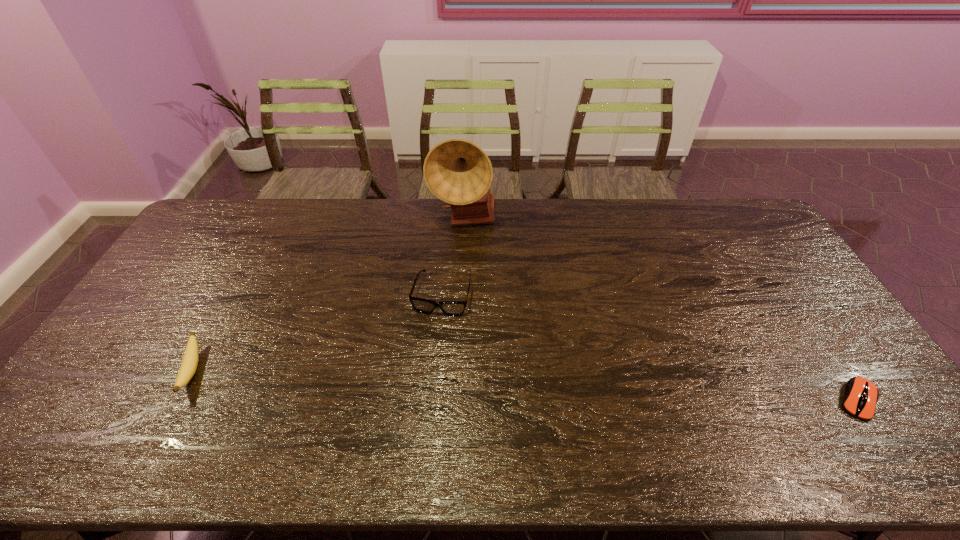
Locate an element on the screen. The height and width of the screenshot is (540, 960). free space at the far edge is located at coordinates (365, 201).

The height and width of the screenshot is (540, 960). I want to click on free space at the near edge of the desktop, so click(x=210, y=399).

Find the location of a particular element. vacant region at the left edge is located at coordinates (180, 295).

Locate an element on the screen. The image size is (960, 540). vacant area at the right edge is located at coordinates (809, 298).

In the image, there is a desktop. Identify the location of vacant region at the far left corner. The image size is (960, 540). (250, 200).

Locate an element on the screen. free space at the far right corner of the desktop is located at coordinates (721, 210).

The width and height of the screenshot is (960, 540). What are the coordinates of `empty space between the second shortest object and the shortest object` in the screenshot? It's located at (525, 385).

Where is `empty location between the computer mouse and the tallest object`? empty location between the computer mouse and the tallest object is located at coordinates (660, 310).

Where is `free space between the computer mouse and the banana`? free space between the computer mouse and the banana is located at coordinates (525, 385).

Where is `vacant space in between the rightmost object and the leftmost object`? The image size is (960, 540). vacant space in between the rightmost object and the leftmost object is located at coordinates (525, 385).